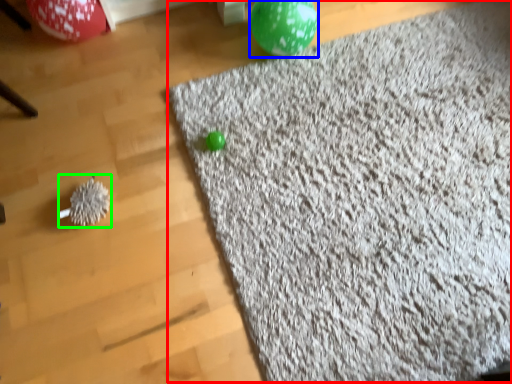
Question: Which object is positioned farthest from mat (highlighted by a red box)? Select from balloon (highlighted by a blue box) and toy (highlighted by a green box).

Choices:
 (A) balloon
 (B) toy

Answer: (B)